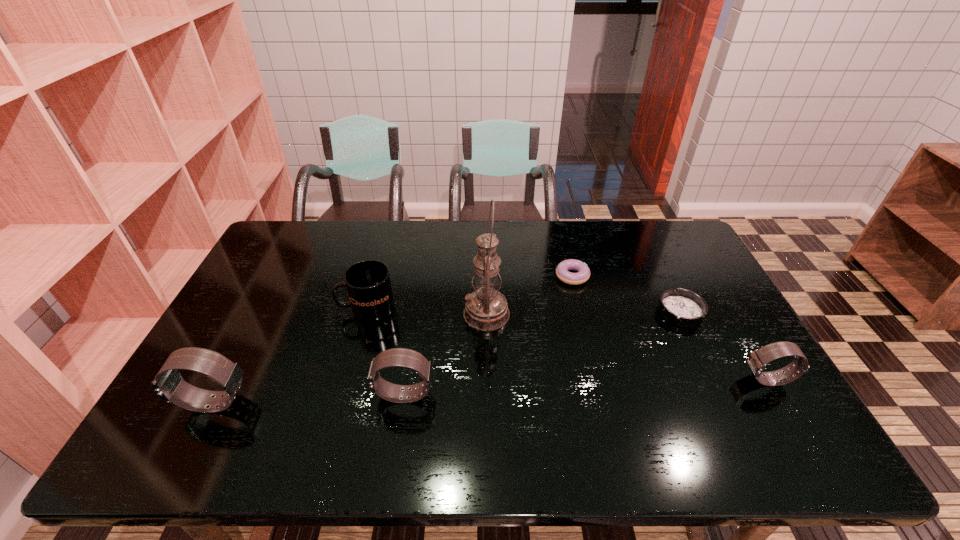
Where is `blank area located 0.080m with the handle on the side of the mug`? The image size is (960, 540). blank area located 0.080m with the handle on the side of the mug is located at coordinates (313, 308).

This screenshot has height=540, width=960. I want to click on vacant space located 0.150m on the left of the second object from right to left, so tap(609, 312).

What are the coordinates of `object at the left edge` in the screenshot? It's located at (169, 385).

Where is `watch positioned at the right edge`? This screenshot has height=540, width=960. watch positioned at the right edge is located at coordinates (757, 361).

Where is `ashtray present at the right edge`? The height and width of the screenshot is (540, 960). ashtray present at the right edge is located at coordinates (682, 307).

Locate an element on the screen. object that is positioned at the near left corner is located at coordinates (169, 385).

This screenshot has height=540, width=960. Find the location of `vacant space at the far edge`. vacant space at the far edge is located at coordinates (468, 256).

In the image, there is a desktop. Where is `vacant space at the near edge`? The height and width of the screenshot is (540, 960). vacant space at the near edge is located at coordinates (443, 404).

Find the location of a particular element. This screenshot has width=960, height=540. vacant space at the left edge of the desktop is located at coordinates (283, 303).

The width and height of the screenshot is (960, 540). In the image, there is a desktop. Find the location of `free space at the right edge`. free space at the right edge is located at coordinates (658, 264).